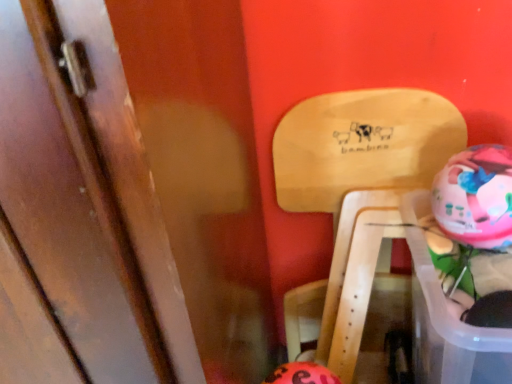
Question: From a real-world perspective, does wooden door at left stand above orange matte piggy bank at lower center, the 1th piggy bank when ordered from left to right?

Choices:
 (A) yes
 (B) no

Answer: (A)

Question: From the image's perspective, is wooden door at left over orange matte piggy bank at lower center, which appears as the 2th piggy bank when viewed from the top?

Choices:
 (A) no
 (B) yes

Answer: (B)

Question: Is wooden door at left bigger than orange matte piggy bank at lower center, the first piggy bank ordered from the bottom?

Choices:
 (A) no
 (B) yes

Answer: (B)

Question: From a real-world perspective, is wooden door at left beneath orange matte piggy bank at lower center, the first piggy bank ordered from the bottom?

Choices:
 (A) no
 (B) yes

Answer: (A)

Question: Does wooden door at left contain orange matte piggy bank at lower center, the 1th piggy bank when ordered from left to right?

Choices:
 (A) yes
 (B) no

Answer: (B)

Question: Do you think wooden door at left is within orange matte piggy bank at lower center, which is the 2th piggy bank in right-to-left order, or outside of it?

Choices:
 (A) inside
 (B) outside

Answer: (B)

Question: In terms of height, does wooden door at left look taller or shorter compared to orange matte piggy bank at lower center, which is the 2th piggy bank in right-to-left order?

Choices:
 (A) tall
 (B) short

Answer: (A)

Question: In the image, is wooden door at left on the left side or the right side of orange matte piggy bank at lower center, which appears as the 2th piggy bank when viewed from the top?

Choices:
 (A) left
 (B) right

Answer: (A)

Question: Considering their positions, is wooden door at left located in front of or behind orange matte piggy bank at lower center, which appears as the 2th piggy bank when viewed from the top?

Choices:
 (A) behind
 (B) front

Answer: (B)

Question: Considering the positions of point (490, 226) and point (366, 112), is point (490, 226) closer or farther from the camera than point (366, 112)?

Choices:
 (A) closer
 (B) farther

Answer: (A)

Question: Based on their positions, is multicolored plastic piggy bank at right, arranged as the first piggy bank when viewed from the right, located to the left or right of natural wood chair at upper right?

Choices:
 (A) left
 (B) right

Answer: (B)

Question: In terms of height, does multicolored plastic piggy bank at right, which is the 2th piggy bank in bottom-to-top order, look taller or shorter compared to natural wood chair at upper right?

Choices:
 (A) tall
 (B) short

Answer: (B)

Question: In the image, is multicolored plastic piggy bank at right, which is the 2th piggy bank in bottom-to-top order, positioned in front of or behind natural wood chair at upper right?

Choices:
 (A) front
 (B) behind

Answer: (A)

Question: From the image's perspective, relative to orange matte piggy bank at lower center, which appears as the 2th piggy bank when viewed from the top, is multicolored plastic piggy bank at right, which is counted as the 1th piggy bank, starting from the top, above or below?

Choices:
 (A) above
 (B) below

Answer: (A)

Question: In terms of height, does multicolored plastic piggy bank at right, which is counted as the 1th piggy bank, starting from the top, look taller or shorter compared to orange matte piggy bank at lower center, which appears as the 2th piggy bank when viewed from the top?

Choices:
 (A) short
 (B) tall

Answer: (A)